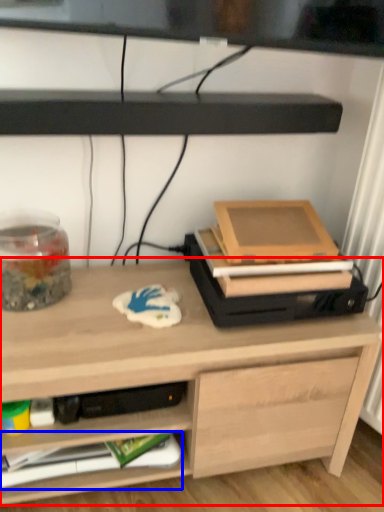
Question: Which point is further to the camera, desk (highlighted by a red box) or paperback book (highlighted by a blue box)?

Choices:
 (A) desk
 (B) paperback book

Answer: (B)